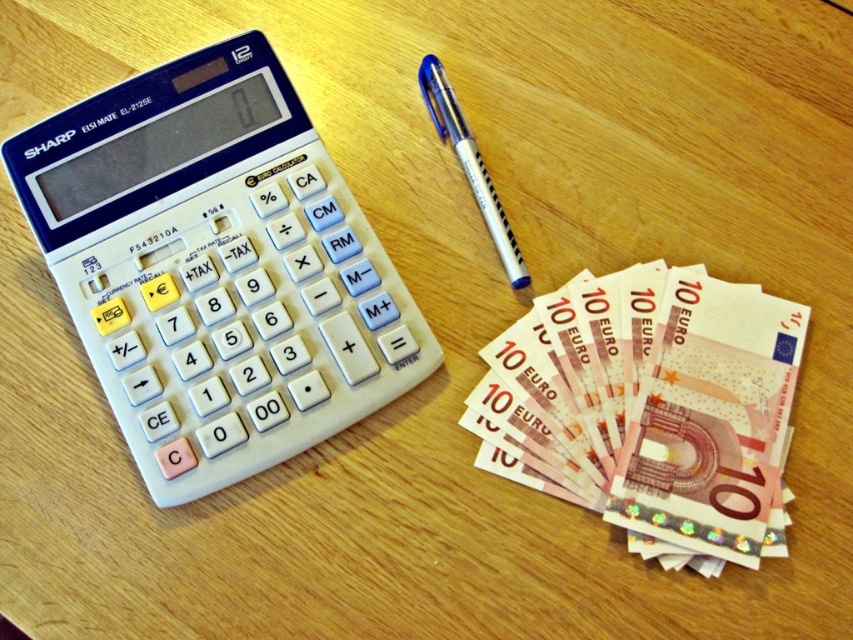
Question: Which object is the closest to the translucent white pen at center?

Choices:
 (A) white plastic calculator at upper left
 (B) pink paper money at lower right

Answer: (B)

Question: Is white plastic calculator at upper left to the right of translucent white pen at center from the viewer's perspective?

Choices:
 (A) yes
 (B) no

Answer: (B)

Question: Can you confirm if white plastic calculator at upper left is positioned below pink paper money at lower right?

Choices:
 (A) no
 (B) yes

Answer: (A)

Question: Does pink paper money at lower right have a larger size compared to translucent white pen at center?

Choices:
 (A) no
 (B) yes

Answer: (B)

Question: Which object is farther from the camera taking this photo?

Choices:
 (A) pink paper money at lower right
 (B) white plastic calculator at upper left
 (C) translucent white pen at center

Answer: (C)

Question: Which point is closer to the camera?

Choices:
 (A) pink paper money at lower right
 (B) white plastic calculator at upper left
 (C) translucent white pen at center

Answer: (A)